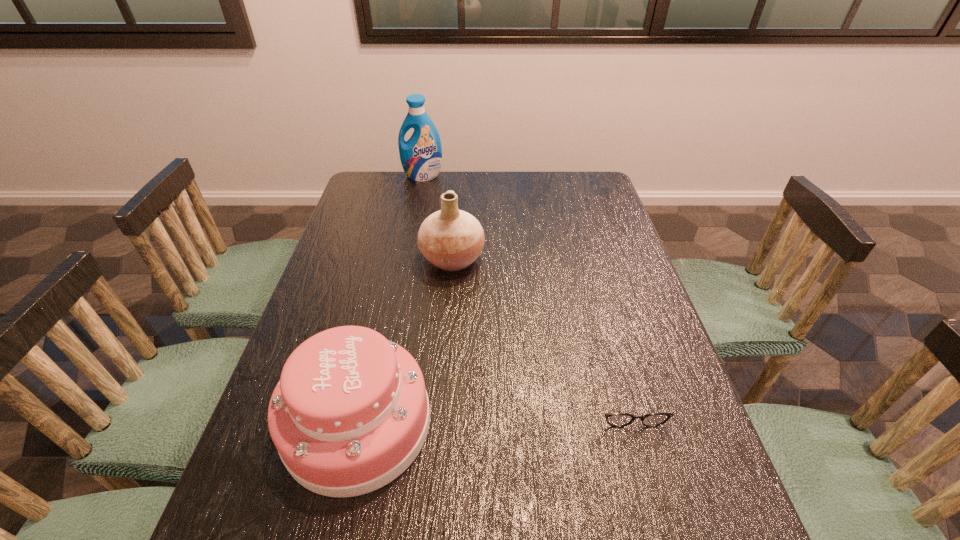
Where is `the farthest object`? The image size is (960, 540). the farthest object is located at coordinates (421, 156).

Locate an element on the screen. Image resolution: width=960 pixels, height=540 pixels. detergent is located at coordinates (421, 156).

I want to click on pottery, so click(x=451, y=239).

Find the location of a particular element. The image size is (960, 540). cake is located at coordinates (350, 413).

Find the location of `spectacles`. spectacles is located at coordinates (613, 419).

Identify the location of the rightmost object. (613, 419).

Where is `vacant region located 0.170m on the front-facing side of the detergent`? This screenshot has width=960, height=540. vacant region located 0.170m on the front-facing side of the detergent is located at coordinates (417, 206).

Identify the location of free space located to pour from the handle of the pottery. (525, 258).

The image size is (960, 540). In order to click on vacant point located on the right of the cake in this screenshot , I will do `click(489, 423)`.

Find the location of `vacant space positioned through the lenses of the spectacles`. vacant space positioned through the lenses of the spectacles is located at coordinates (649, 477).